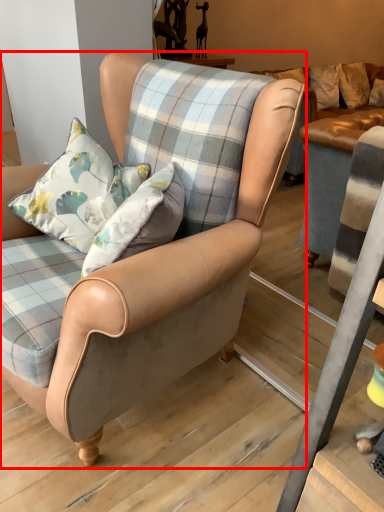
Question: Where is chair (annotated by the red box) located in relation to pillow in the image?

Choices:
 (A) left
 (B) right

Answer: (B)